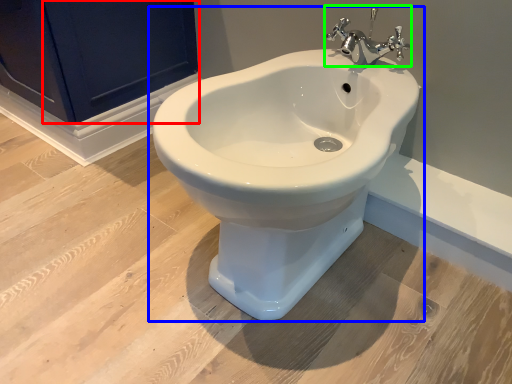
Question: Which object is positioned closest to screen door (highlighted by a red box)? Select from toilet (highlighted by a blue box) and tap (highlighted by a green box).

Choices:
 (A) toilet
 (B) tap

Answer: (B)